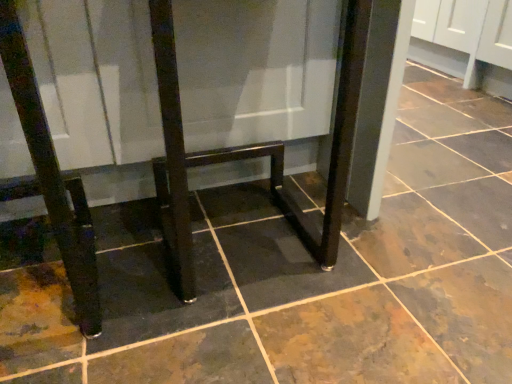
The width and height of the screenshot is (512, 384). What are the coordinates of `vacant region to the right of glossy dark wood table at center, which appears as the first furniture when viewed from the right` in the screenshot? It's located at (394, 258).